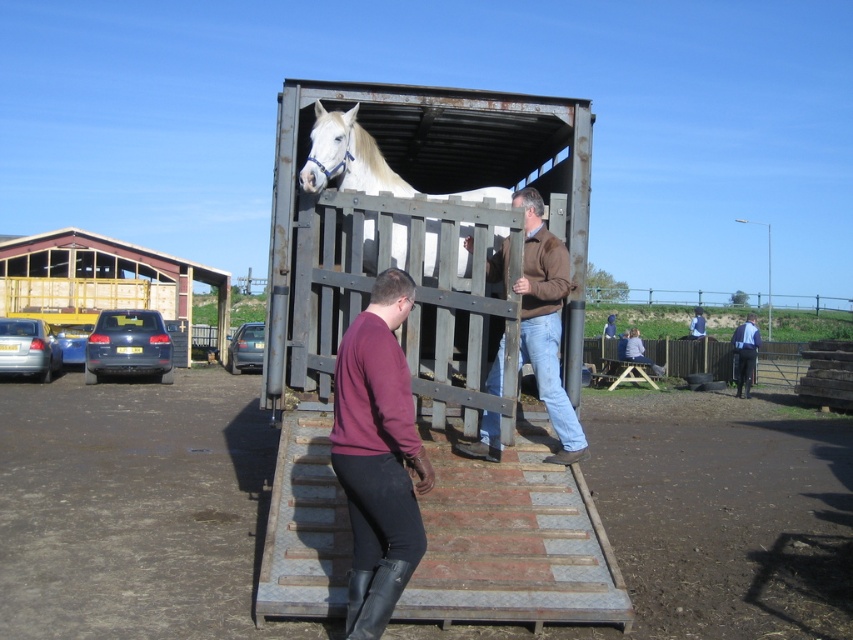
Is point (399, 484) positioned behind point (318, 186)?

No, it is in front of (318, 186).

Which of these two, maroon sweater at center or white glossy horse at center, stands shorter?

Standing shorter between the two is white glossy horse at center.

Which is behind, point (367, 548) or point (463, 228)?

The point (463, 228) is behind.

Locate an element on the screen. maroon sweater at center is located at coordinates (378, 456).

Does brown leather jacket at center lie behind blue denim jacket at right?

That is False.

How far apart are brown leather jacket at center and blue denim jacket at right?

brown leather jacket at center and blue denim jacket at right are 48.72 feet apart from each other.

Which is in front, point (527, 275) or point (734, 369)?

Point (527, 275) is in front.

Identify the location of brown leather jacket at center. The height and width of the screenshot is (640, 853). (544, 323).

Between point (321, 150) and point (747, 355), which one is positioned behind?

Point (747, 355)

Is white glossy horse at center thinner than blue denim jacket at right?

In fact, white glossy horse at center might be wider than blue denim jacket at right.

You are a GUI agent. You are given a task and a screenshot of the screen. Output one action in this format:
    pyautogui.click(x=<x>, y=<y>)
    Task: Click on the white glossy horse at center
    The height and width of the screenshot is (640, 853).
    Given the screenshot: What is the action you would take?
    pyautogui.click(x=347, y=156)

Find the location of a particular element. white glossy horse at center is located at coordinates (347, 156).